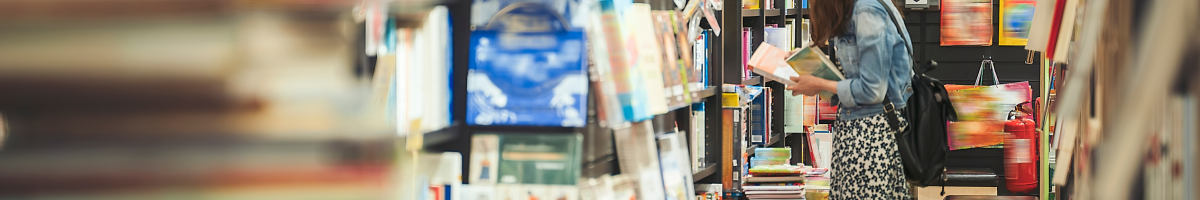
You are a GUI agent. You are given a task and a screenshot of the screen. Output one action in this format:
    pyautogui.click(x=<x>, y=<y>)
    Task: Click on the door
    
    Given the screenshot: What is the action you would take?
    (954, 64)